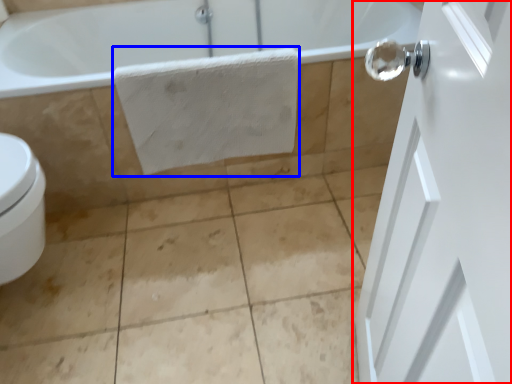
Question: Which object appears closest to the camera in this image, door (highlighted by a red box) or bath towel (highlighted by a blue box)?

Choices:
 (A) door
 (B) bath towel

Answer: (A)